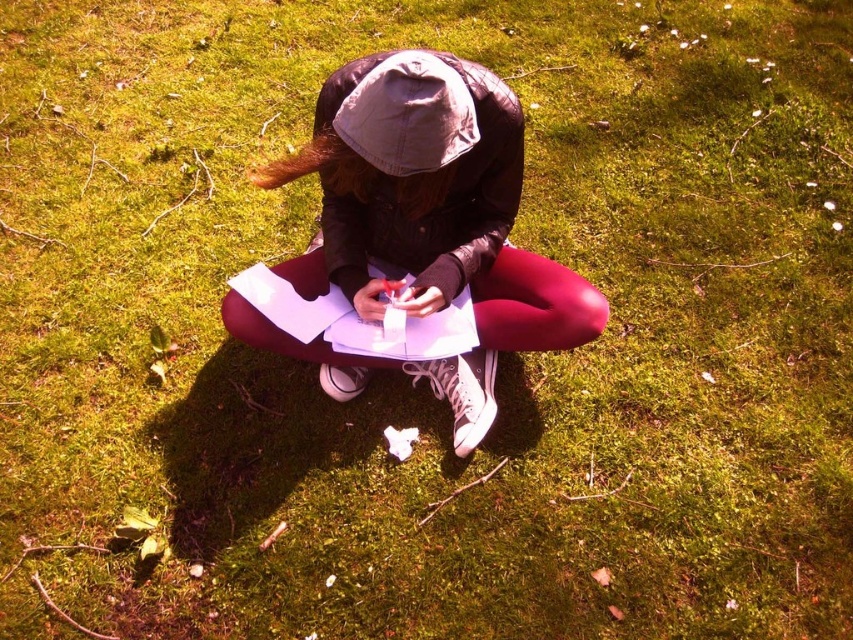
Which of these two, matte black jacket at center or light gray fabric hat at center, stands shorter?

Standing shorter between the two is light gray fabric hat at center.

The width and height of the screenshot is (853, 640). Find the location of `matte black jacket at center`. matte black jacket at center is located at coordinates (422, 225).

Is point (256, 172) farther from camera compared to point (437, 154)?

Yes, point (256, 172) is farther from viewer.

The width and height of the screenshot is (853, 640). Identify the location of matte black jacket at center. (422, 225).